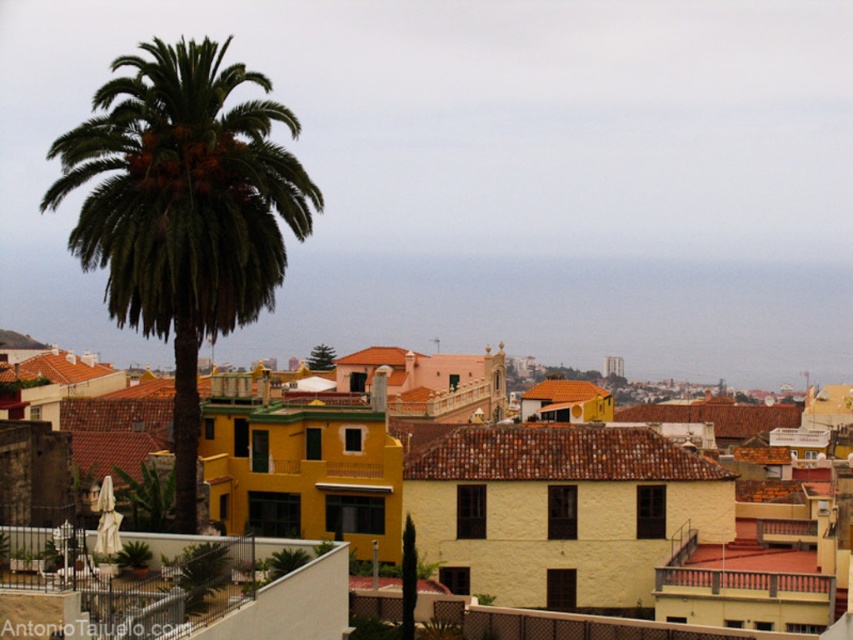
Between green leafy palm at left and white wrought iron balcony at lower left, which one appears on the right side from the viewer's perspective?

white wrought iron balcony at lower left is more to the right.

Consider the image. Is green leafy palm at left thinner than white wrought iron balcony at lower left?

No.

Image resolution: width=853 pixels, height=640 pixels. I want to click on green leafy palm at left, so click(x=183, y=211).